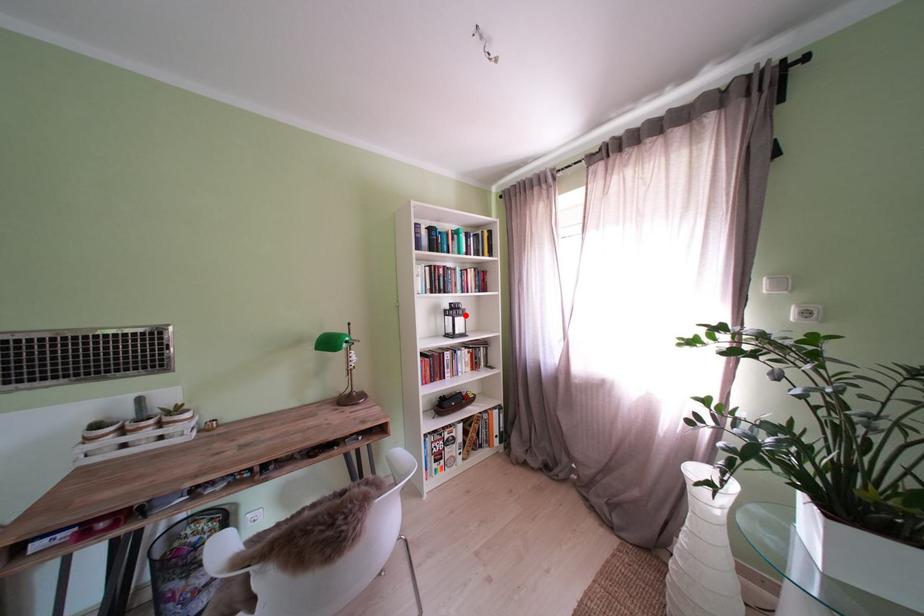
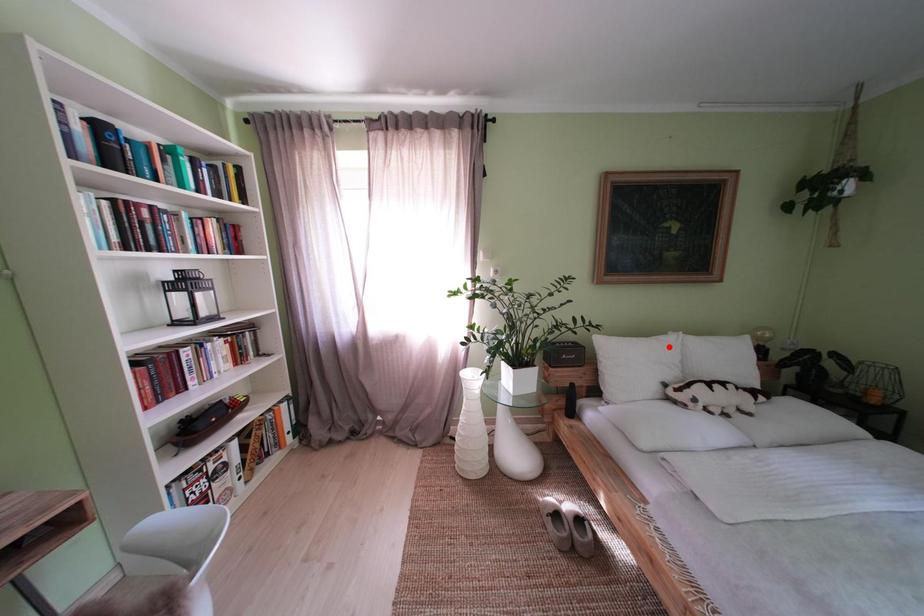
I am providing you with two images of the same scene from different viewpoints. A red point is marked on the first image and another point is marked on the second image. Do the highlighted points in image1 and image2 indicate the same real-world spot?

No